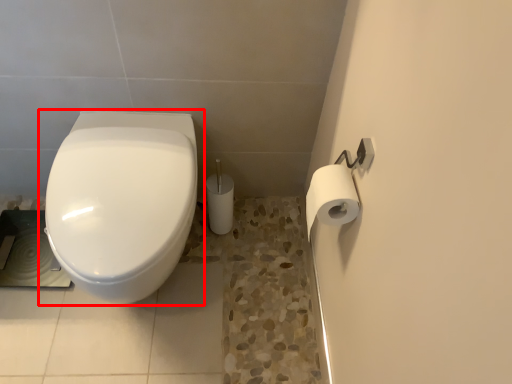
Question: Observing the image, what is the correct spatial positioning of toilet (annotated by the red box) in reference to toilet paper?

Choices:
 (A) left
 (B) right

Answer: (A)